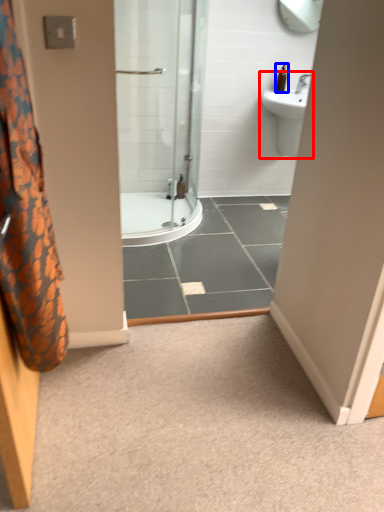
Question: Which of the following is the farthest to the observer, sink (highlighted by a red box) or toiletry (highlighted by a blue box)?

Choices:
 (A) sink
 (B) toiletry

Answer: (B)